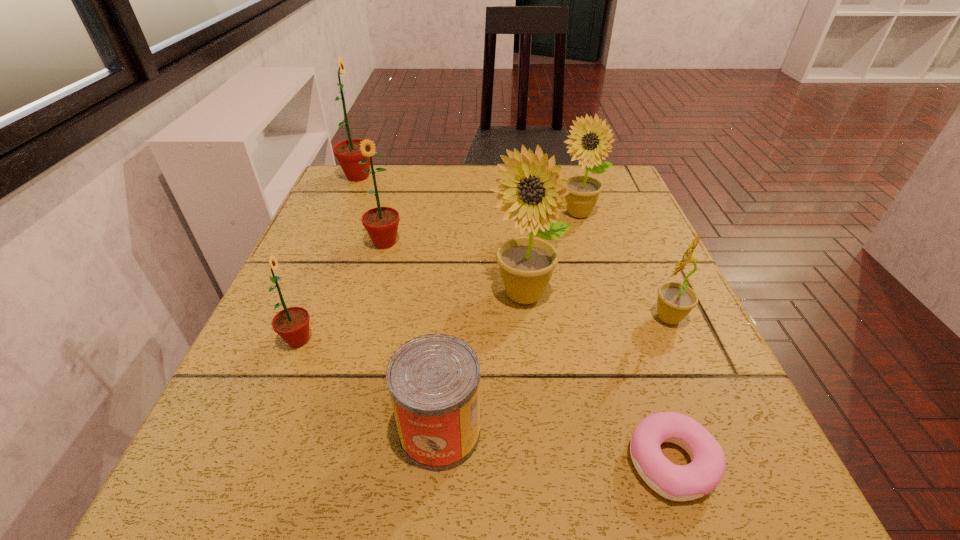
Locate an element on the screen. This screenshot has width=960, height=540. the smallest green sunflower is located at coordinates (292, 324).

This screenshot has width=960, height=540. I want to click on the seventh tallest object, so click(x=434, y=380).

I want to click on can, so 434,380.

Locate an element on the screen. The image size is (960, 540). pink pastry is located at coordinates (674, 482).

Locate an element on the screen. This screenshot has height=540, width=960. pastry is located at coordinates (674, 482).

Locate an element on the screen. The width and height of the screenshot is (960, 540). free space located on the face of the farthest green sunflower is located at coordinates (418, 177).

Where is `vacant space located 0.330m on the face of the biggest yellow sunflower`? This screenshot has height=540, width=960. vacant space located 0.330m on the face of the biggest yellow sunflower is located at coordinates [546, 512].

Locate an element on the screen. vacant space located 0.160m on the face of the rightmost green sunflower is located at coordinates (367, 308).

Image resolution: width=960 pixels, height=540 pixels. What are the coordinates of `vacant space located 0.310m on the face of the second smallest yellow sunflower` in the screenshot? It's located at (612, 325).

Locate an element on the screen. This screenshot has height=540, width=960. vacant space located 0.360m on the face of the smallest yellow sunflower is located at coordinates (446, 318).